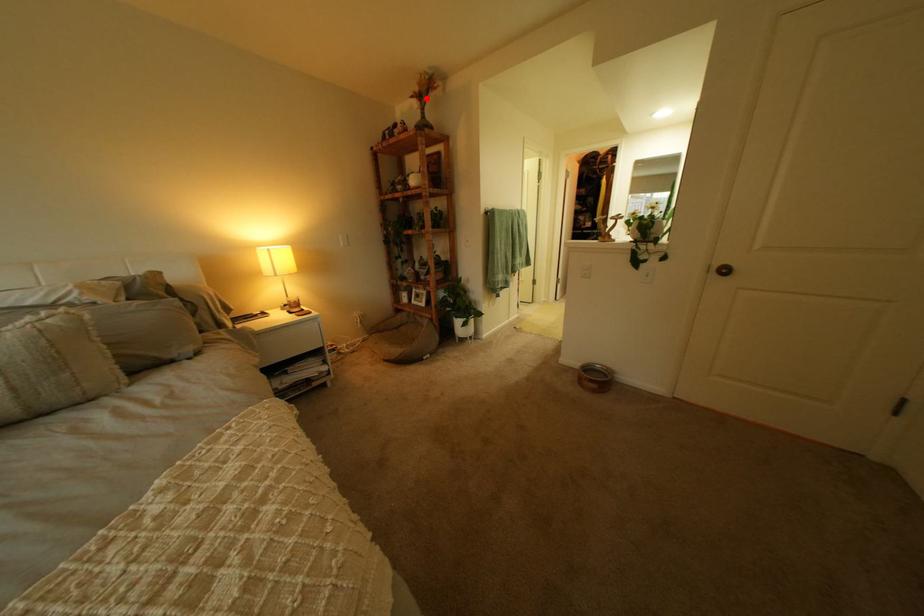
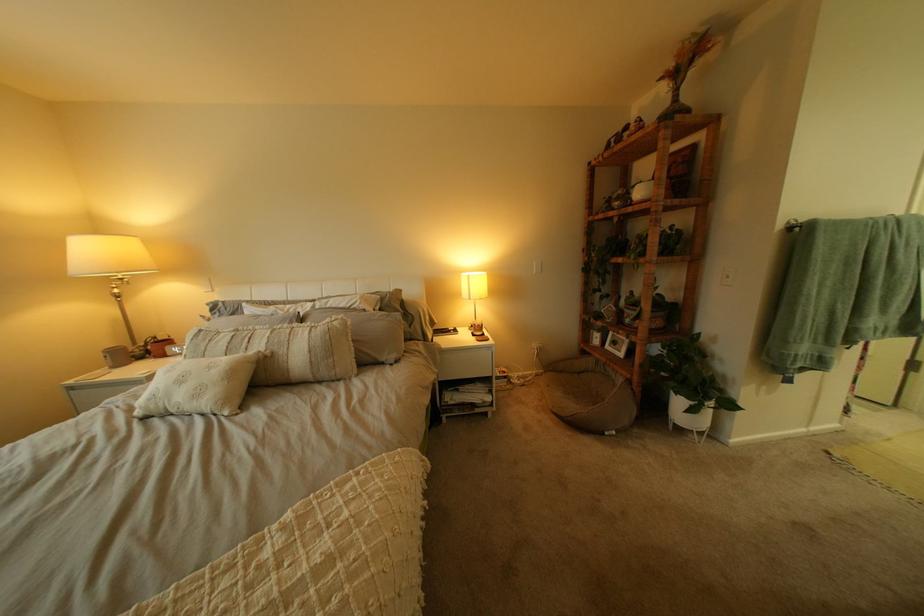
Question: I am providing you with two images of the same scene from different viewpoints. A red point is shown in image1. For the corresponding object point in image2, is it positioned nearer or farther from the camera?

Choices:
 (A) Nearer
 (B) Farther

Answer: (B)